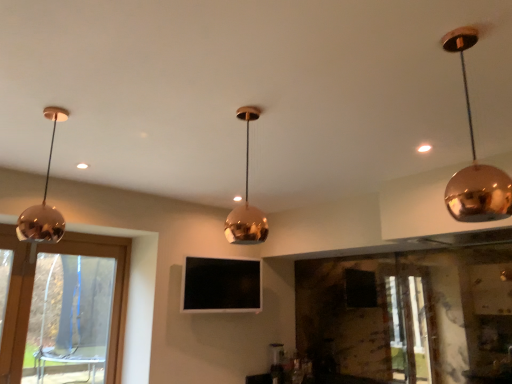
Question: From a real-world perspective, is polished copper pendant light at center, the second lamp when ordered from left to right, physically above shiny copper pendant light at left, positioned as the third lamp in right-to-left order?

Choices:
 (A) yes
 (B) no

Answer: (B)

Question: Is polished copper pendant light at center, the second lamp when ordered from left to right, positioned with its back to shiny copper pendant light at left, acting as the first lamp starting from the left?

Choices:
 (A) no
 (B) yes

Answer: (A)

Question: Is polished copper pendant light at center, the second lamp when ordered from left to right, completely or partially outside of shiny copper pendant light at left, acting as the first lamp starting from the left?

Choices:
 (A) yes
 (B) no

Answer: (A)

Question: Does polished copper pendant light at center, the second lamp when ordered from left to right, have a lesser height compared to shiny copper pendant light at left, positioned as the third lamp in right-to-left order?

Choices:
 (A) yes
 (B) no

Answer: (A)

Question: From the image's perspective, is polished copper pendant light at center, the second lamp when ordered from left to right, located beneath shiny copper pendant light at left, acting as the first lamp starting from the left?

Choices:
 (A) yes
 (B) no

Answer: (A)

Question: Considering the positions of matte black tv at center and shiny copper pendant light at left, acting as the first lamp starting from the left, in the image, is matte black tv at center bigger or smaller than shiny copper pendant light at left, acting as the first lamp starting from the left,?

Choices:
 (A) big
 (B) small

Answer: (A)

Question: Visually, is matte black tv at center positioned to the left or to the right of shiny copper pendant light at left, acting as the first lamp starting from the left?

Choices:
 (A) left
 (B) right

Answer: (B)

Question: Is point (234, 301) closer or farther from the camera than point (17, 231)?

Choices:
 (A) farther
 (B) closer

Answer: (A)

Question: Would you say matte black tv at center is inside or outside shiny copper pendant light at left, acting as the first lamp starting from the left?

Choices:
 (A) outside
 (B) inside

Answer: (A)

Question: Is transparent glass window at left wider or thinner than shiny copper pendant light at upper right, placed as the 1th lamp when sorted from right to left?

Choices:
 (A) thin
 (B) wide

Answer: (A)

Question: From the image's perspective, is transparent glass window at left above or below shiny copper pendant light at upper right, placed as the 1th lamp when sorted from right to left?

Choices:
 (A) above
 (B) below

Answer: (B)

Question: Is transparent glass window at left in front of or behind shiny copper pendant light at upper right, acting as the third lamp starting from the left, in the image?

Choices:
 (A) behind
 (B) front

Answer: (A)

Question: Considering the positions of point (73, 271) and point (464, 34), is point (73, 271) closer or farther from the camera than point (464, 34)?

Choices:
 (A) farther
 (B) closer

Answer: (A)

Question: Considering the positions of matte white light at upper right and matte black tv at center in the image, is matte white light at upper right taller or shorter than matte black tv at center?

Choices:
 (A) tall
 (B) short

Answer: (B)

Question: Considering the positions of point (425, 150) and point (241, 264), is point (425, 150) closer or farther from the camera than point (241, 264)?

Choices:
 (A) farther
 (B) closer

Answer: (B)